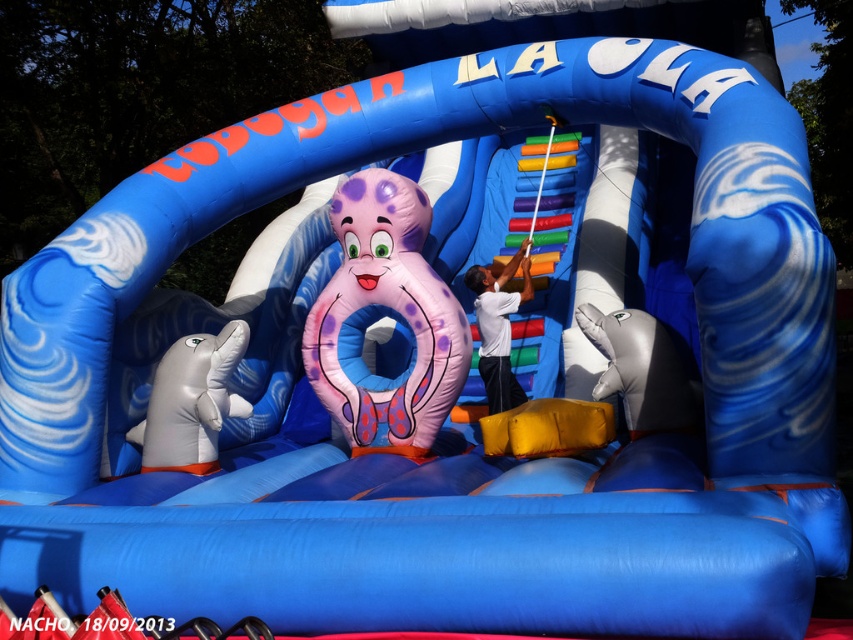
Is white rubber dolphin at lower left bigger than white smooth shirt at center?

Correct, white rubber dolphin at lower left is larger in size than white smooth shirt at center.

Is white rubber dolphin at lower left smaller than white smooth shirt at center?

No, white rubber dolphin at lower left is not smaller than white smooth shirt at center.

Between point (177, 422) and point (508, 380), which one is positioned in front?

Point (177, 422) is more forward.

The width and height of the screenshot is (853, 640). In order to click on white rubber dolphin at lower left in this screenshot , I will do [190, 401].

Between metallic silver dolphin at lower right and white smooth shirt at center, which one has less height?

With less height is metallic silver dolphin at lower right.

Between metallic silver dolphin at lower right and white smooth shirt at center, which one has more height?

With more height is white smooth shirt at center.

Is point (625, 323) less distant than point (476, 278)?

Yes.

At what (x,y) coordinates should I click in order to perform the action: click on metallic silver dolphin at lower right. Please return your answer as a coordinate pair (x, y). Image resolution: width=853 pixels, height=640 pixels. Looking at the image, I should click on (643, 369).

Which of these two, pink rubber octopus at center or metallic silver dolphin at lower right, stands shorter?

metallic silver dolphin at lower right

Which is behind, point (349, 209) or point (634, 310)?

Positioned behind is point (349, 209).

This screenshot has height=640, width=853. Find the location of `pink rubber octopus at center`. pink rubber octopus at center is located at coordinates [x=386, y=317].